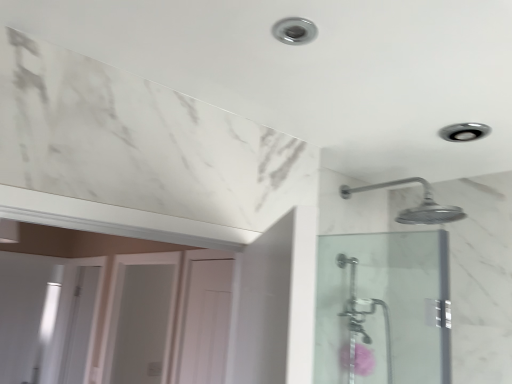
Question: Can you confirm if pink fluffy flower at lower right is thinner than white glossy door at center, marked as the second screen door in a right-to-left arrangement?

Choices:
 (A) no
 (B) yes

Answer: (B)

Question: Is pink fluffy flower at lower right shorter than white glossy door at center, marked as the second screen door in a right-to-left arrangement?

Choices:
 (A) yes
 (B) no

Answer: (A)

Question: Can you confirm if pink fluffy flower at lower right is positioned to the right of white glossy door at center, which is counted as the 2th screen door, starting from the front?

Choices:
 (A) no
 (B) yes

Answer: (B)

Question: Is pink fluffy flower at lower right looking in the opposite direction of white glossy door at center, which is counted as the 2th screen door, starting from the front?

Choices:
 (A) yes
 (B) no

Answer: (A)

Question: From a real-world perspective, is pink fluffy flower at lower right under white glossy door at center, which is counted as the 2th screen door, starting from the front?

Choices:
 (A) no
 (B) yes

Answer: (A)

Question: Can you confirm if pink fluffy flower at lower right is smaller than white glossy door at center, which is counted as the 2th screen door, starting from the front?

Choices:
 (A) no
 (B) yes

Answer: (B)

Question: From a real-world perspective, is pink fluffy flower at lower right on top of white glossy screen door at lower left, the first screen door from the back?

Choices:
 (A) no
 (B) yes

Answer: (B)

Question: Is the position of pink fluffy flower at lower right more distant than that of white glossy screen door at lower left, which ranks as the 3th screen door in right-to-left order?

Choices:
 (A) yes
 (B) no

Answer: (B)

Question: From the image's perspective, is pink fluffy flower at lower right above white glossy screen door at lower left, which ranks as the first screen door in left-to-right order?

Choices:
 (A) yes
 (B) no

Answer: (A)

Question: Is pink fluffy flower at lower right shorter than white glossy screen door at lower left, the 3th screen door viewed from the front?

Choices:
 (A) no
 (B) yes

Answer: (B)

Question: Considering the relative sizes of pink fluffy flower at lower right and white glossy screen door at lower left, the 3th screen door viewed from the front, in the image provided, is pink fluffy flower at lower right bigger than white glossy screen door at lower left, the 3th screen door viewed from the front,?

Choices:
 (A) yes
 (B) no

Answer: (B)

Question: Is pink fluffy flower at lower right oriented towards white glossy screen door at lower left, which ranks as the first screen door in left-to-right order?

Choices:
 (A) no
 (B) yes

Answer: (A)

Question: Could you tell me if pink fluffy flower at lower right is turned towards clear glass shower door at right, placed as the 3th screen door when sorted from back to front?

Choices:
 (A) no
 (B) yes

Answer: (A)